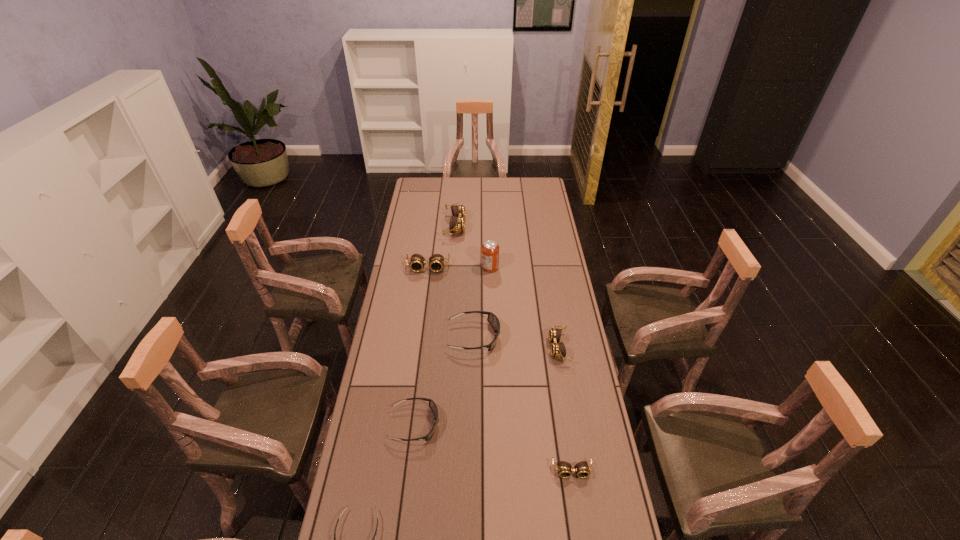
Identify the location of blank area located on the lenses of the fifth farthest goggles. (550, 424).

Identify the location of free spot located 0.070m through the lenses of the second nearest object. The image size is (960, 540). (577, 503).

The width and height of the screenshot is (960, 540). In the image, there is a desktop. In order to click on vacant space at the far edge in this screenshot , I will do `click(502, 190)`.

Find the location of a particular element. free space at the left edge is located at coordinates (413, 316).

Find the location of a particular element. The width and height of the screenshot is (960, 540). free region at the right edge of the desktop is located at coordinates (537, 232).

At what (x,y) coordinates should I click in order to perform the action: click on vacant area at the far left corner. Please return your answer as a coordinate pair (x, y). Looking at the image, I should click on (423, 183).

In the image, there is a desktop. Where is `vacant area at the far right corner`? vacant area at the far right corner is located at coordinates (540, 180).

This screenshot has height=540, width=960. I want to click on free spot between the can and the third smallest brown goggles, so click(459, 268).

The width and height of the screenshot is (960, 540). Find the location of `free spot between the nearest brown goggles and the second tallest goggles`. free spot between the nearest brown goggles and the second tallest goggles is located at coordinates (500, 369).

The height and width of the screenshot is (540, 960). Identify the location of free spot between the can and the farthest black goggles. (482, 302).